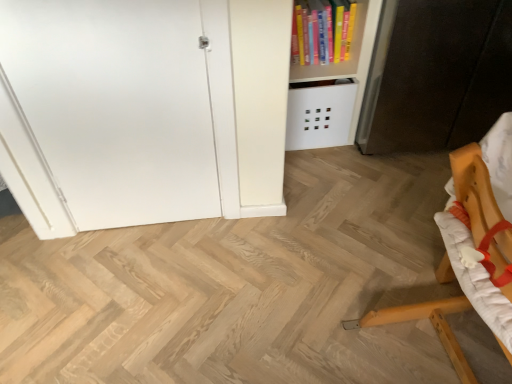
Question: Would you say white matte door at left is outside dark brown wood cabinet at right?

Choices:
 (A) no
 (B) yes

Answer: (B)

Question: Is white matte door at left turned away from dark brown wood cabinet at right?

Choices:
 (A) yes
 (B) no

Answer: (B)

Question: Is the position of white matte door at left more distant than that of dark brown wood cabinet at right?

Choices:
 (A) no
 (B) yes

Answer: (A)

Question: From a real-world perspective, is white matte door at left physically below dark brown wood cabinet at right?

Choices:
 (A) no
 (B) yes

Answer: (A)

Question: Can you confirm if white matte door at left is positioned to the right of dark brown wood cabinet at right?

Choices:
 (A) yes
 (B) no

Answer: (B)

Question: From the image's perspective, is wooden chair at lower right positioned above or below hardcover book at upper right?

Choices:
 (A) above
 (B) below

Answer: (B)

Question: Considering their positions, is wooden chair at lower right located in front of or behind hardcover book at upper right?

Choices:
 (A) behind
 (B) front

Answer: (B)

Question: In the image, is wooden chair at lower right on the left side or the right side of hardcover book at upper right?

Choices:
 (A) right
 (B) left

Answer: (A)

Question: Is wooden chair at lower right bigger or smaller than hardcover book at upper right?

Choices:
 (A) small
 (B) big

Answer: (B)

Question: In terms of width, does white matte door at left look wider or thinner when compared to dark brown wood cabinet at right?

Choices:
 (A) wide
 (B) thin

Answer: (B)

Question: From their relative heights in the image, would you say white matte door at left is taller or shorter than dark brown wood cabinet at right?

Choices:
 (A) short
 (B) tall

Answer: (B)

Question: Does point (218, 26) appear closer or farther from the camera than point (422, 92)?

Choices:
 (A) closer
 (B) farther

Answer: (A)

Question: Considering their positions, is white matte door at left located in front of or behind dark brown wood cabinet at right?

Choices:
 (A) behind
 (B) front

Answer: (B)

Question: Considering the positions of dark brown wood cabinet at right and wooden chair at lower right in the image, is dark brown wood cabinet at right taller or shorter than wooden chair at lower right?

Choices:
 (A) short
 (B) tall

Answer: (A)

Question: Looking at the image, does dark brown wood cabinet at right seem bigger or smaller compared to wooden chair at lower right?

Choices:
 (A) big
 (B) small

Answer: (A)